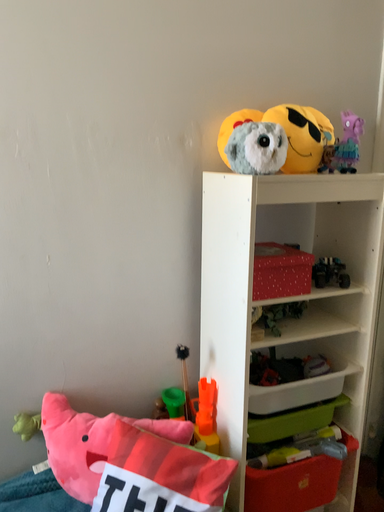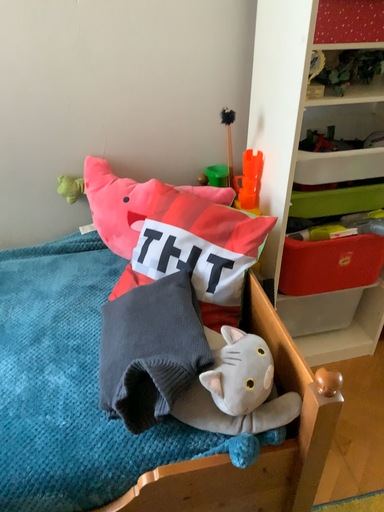
Question: How did the camera likely rotate when shooting the video?

Choices:
 (A) rotated downward
 (B) rotated upward

Answer: (A)